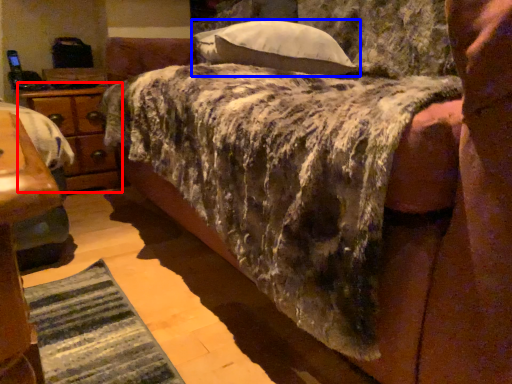
Question: Which of the following is the farthest to the observer, nightstand (highlighted by a red box) or pillow (highlighted by a blue box)?

Choices:
 (A) nightstand
 (B) pillow

Answer: (A)